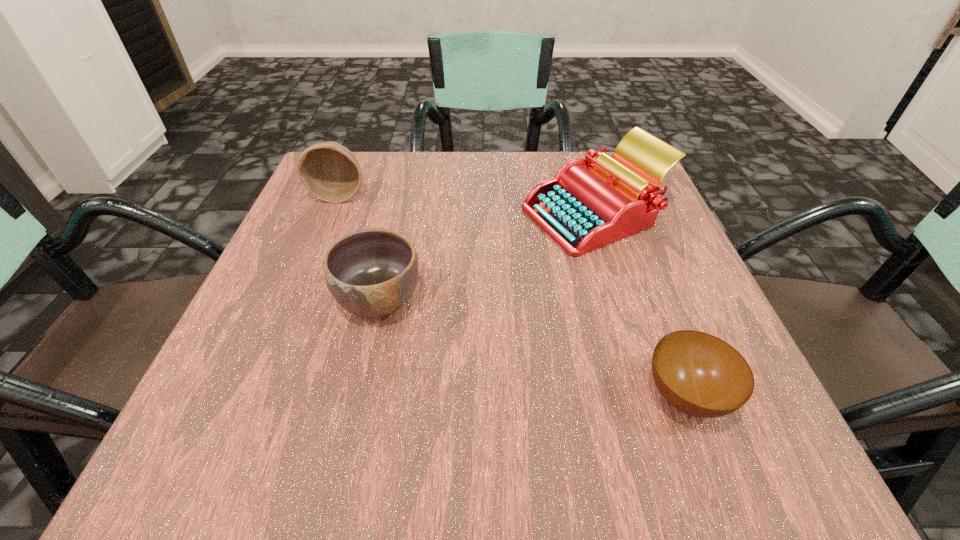
The image size is (960, 540). What are the coordinates of `the tallest bowl` in the screenshot? It's located at (330, 172).

You are a GUI agent. You are given a task and a screenshot of the screen. Output one action in this format:
    pyautogui.click(x=<x>, y=<y>)
    Task: Click on the leftmost bowl
    The height and width of the screenshot is (540, 960).
    Given the screenshot: What is the action you would take?
    pyautogui.click(x=330, y=172)

Where is `typewriter`? Image resolution: width=960 pixels, height=540 pixels. typewriter is located at coordinates (589, 203).

Identify the location of the second bowl from left to right. (371, 273).

Locate an element on the screen. the third object from right to left is located at coordinates (371, 273).

Image resolution: width=960 pixels, height=540 pixels. Identify the location of the shortest bowl. (699, 374).

Identify the location of the rightmost bowl. (699, 374).

This screenshot has width=960, height=540. In order to click on vacant space positioned on the right of the leftmost bowl in this screenshot , I will do `click(456, 195)`.

Identify the location of free spot located on the typing side of the typewriter. This screenshot has height=540, width=960. coord(459,215).

Identify the location of free space located on the typing side of the typewriter. The height and width of the screenshot is (540, 960). (352, 215).